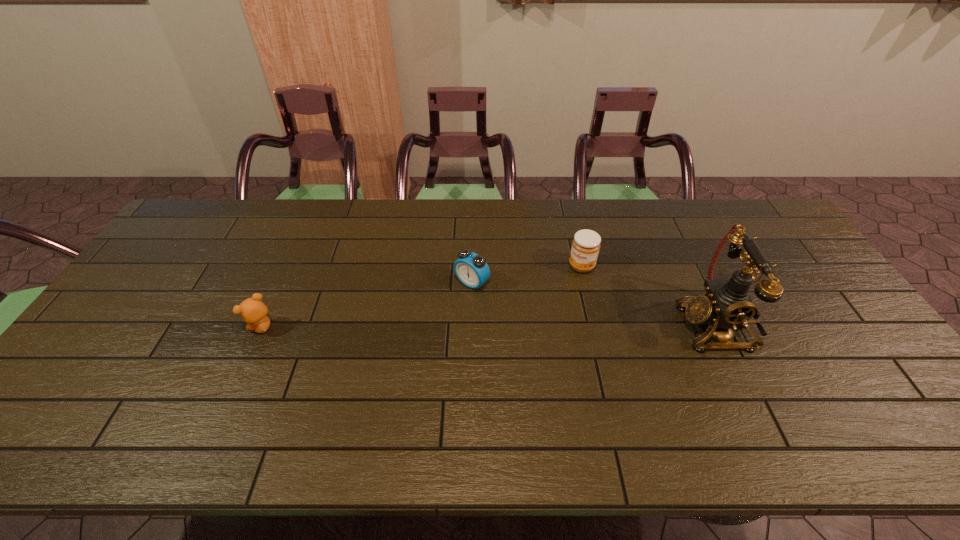
Where is `the leftmost object`? the leftmost object is located at coordinates (253, 311).

Where is `telephone`? Image resolution: width=960 pixels, height=540 pixels. telephone is located at coordinates (727, 304).

The width and height of the screenshot is (960, 540). What are the coordinates of `the tallest object` in the screenshot? It's located at (727, 304).

This screenshot has width=960, height=540. I want to click on the third object from left to right, so click(x=585, y=248).

Where is `the second object from left to right`? This screenshot has width=960, height=540. the second object from left to right is located at coordinates (471, 269).

Find the location of a particular element. free spot located on the face of the teddy bear is located at coordinates (144, 328).

Image resolution: width=960 pixels, height=540 pixels. I want to click on free space located on the face of the teddy bear, so click(132, 328).

In order to click on vacant space located on the face of the teddy bear in this screenshot , I will do `click(187, 328)`.

I want to click on blank space located 0.210m on the front of the telephone, featuring the rotary dial, so click(603, 326).

I want to click on free space located on the front of the telephone, featuring the rotary dial, so click(570, 326).